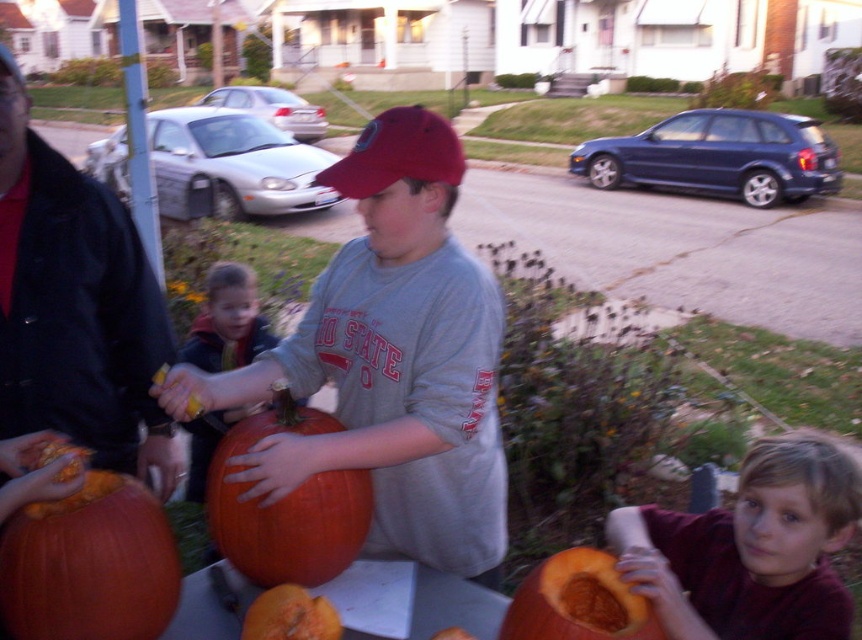
Question: Is orange matte pumpkin at lower left above orange matte pumpkin at center?

Choices:
 (A) no
 (B) yes

Answer: (A)

Question: Estimate the real-world distances between objects in this image. Which object is farther from the orange matte pumpkin at lower right?

Choices:
 (A) smooth orange pumpkin at lower right
 (B) orange matte pumpkin at center

Answer: (B)

Question: Estimate the real-world distances between objects in this image. Which object is farther from the orange matte pumpkin at center?

Choices:
 (A) brushed metal pumpkin at lower left
 (B) orange matte pumpkin at lower left

Answer: (A)

Question: Which object is the farthest from the smooth orange pumpkin at lower right?

Choices:
 (A) orange matte pumpkin at center
 (B) brushed metal pumpkin at lower left
 (C) orange matte pumpkin at lower right

Answer: (B)

Question: Does matte gray shirt at center have a larger size compared to orange matte pumpkin at lower center?

Choices:
 (A) yes
 (B) no

Answer: (A)

Question: Is smooth orange pumpkin at lower right to the right of orange matte pumpkin at lower left from the viewer's perspective?

Choices:
 (A) no
 (B) yes

Answer: (B)